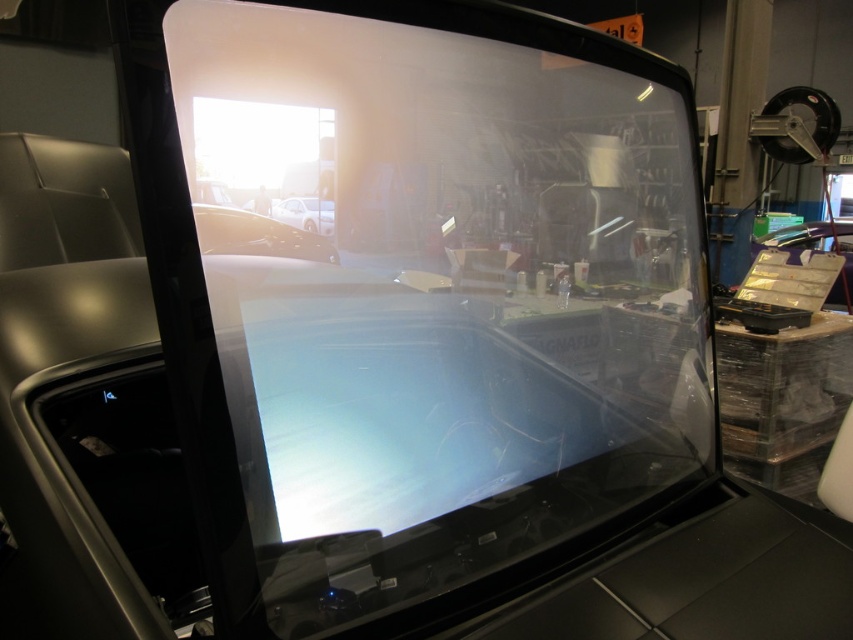
Between glossy white car at center and matte black car at right, which one has less height?

glossy white car at center

Is point (294, 237) closer to camera compared to point (851, 294)?

Yes, it is in front of point (851, 294).

Between point (305, 256) and point (816, 241), which one is positioned in front?

Point (305, 256)

Where is `glossy white car at center`? The height and width of the screenshot is (640, 853). glossy white car at center is located at coordinates (256, 236).

From the picture: Can you confirm if glossy white car at center is positioned to the left of white glossy car at center?

Yes, glossy white car at center is to the left of white glossy car at center.

Is glossy white car at center positioned before white glossy car at center?

Yes, it is in front of white glossy car at center.

Describe the element at coordinates (256, 236) in the screenshot. I see `glossy white car at center` at that location.

Locate an element on the screen. This screenshot has width=853, height=640. glossy white car at center is located at coordinates (256, 236).

Does matte black car at right have a greater height compared to white glossy car at center?

Indeed, matte black car at right has a greater height compared to white glossy car at center.

Is point (776, 237) closer to viewer compared to point (321, 205)?

No.

Who is more forward, (842,241) or (302,220)?

Positioned in front is point (302,220).

This screenshot has height=640, width=853. I want to click on matte black car at right, so click(x=815, y=250).